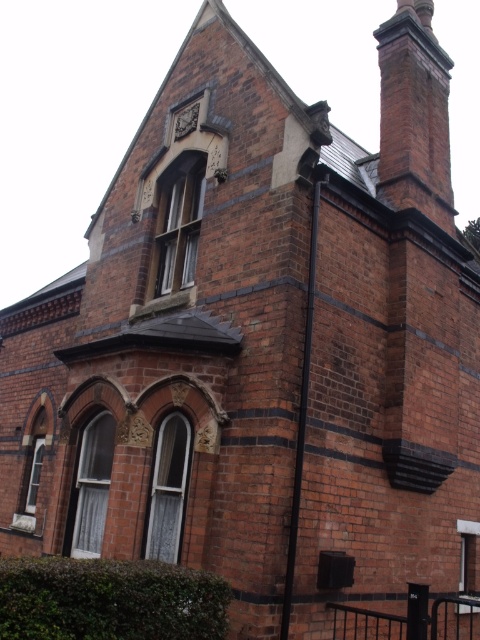
You are an architect inspecting a Victorian building. You notice the brick chimney at upper right and the dark brown stone clock at upper center. Which object is positioned higher on the building?

The brick chimney at upper right is positioned higher on the building than the dark brown stone clock at upper center because it is located above it.

You are a contractor assessing the distance between two architectural elements on a Victorian building. You need to install a new support beam between the brick chimney at upper right and the dark brown stone clock at upper center. The beam must be exactly 10 meters long. Based on the scene, will the beam fit properly between them?

The brick chimney at upper right and dark brown stone clock at upper center are 10.77 meters apart. Since the beam is only 10 meters long, it will be 0.77 meters too short to span the distance between them. Therefore, the beam will not fit properly.

You are a painter hired to paint the brick chimney at upper right and the dark brown stone clock at upper center. You have a ladder that can reach up to 10 meters. The building is 9 meters tall. Can you safely paint both objects using this ladder without needing a taller ladder?

The building is 9 meters tall, and the ladder can reach up to 10 meters. Since the ladder can reach higher than the building, you can safely paint both the brick chimney at upper right and the dark brown stone clock at upper center without needing a taller ladder.